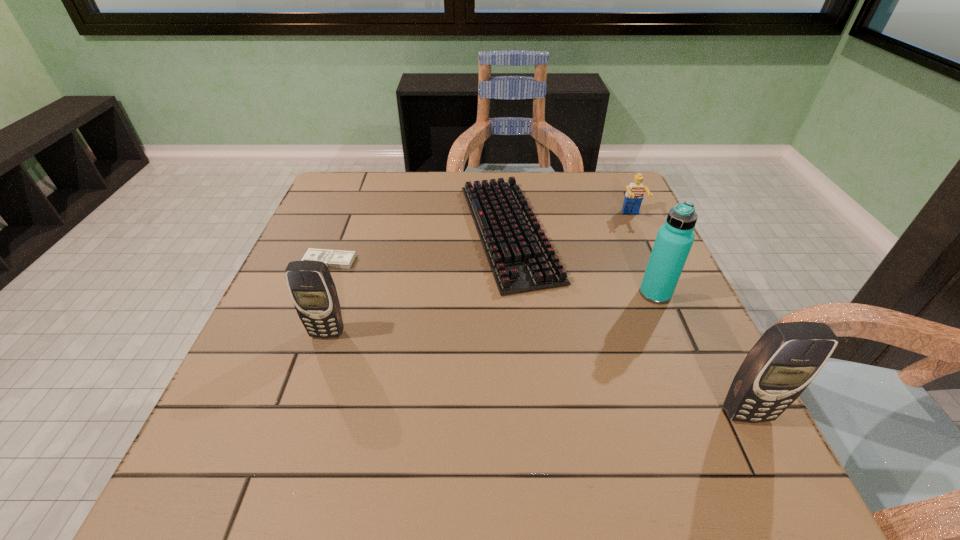
Locate an element on the screen. vacant space that is in between the second shortest object and the money is located at coordinates (420, 246).

Identify the location of free area in between the shorter cellular telephone and the fourth tallest object. (480, 274).

In order to click on vacant point located between the right cellular telephone and the fourth shortest object in this screenshot , I will do `click(537, 374)`.

The width and height of the screenshot is (960, 540). What are the coordinates of `vacant region between the shortest object and the nearest object` in the screenshot? It's located at (538, 338).

Find the location of a particular element. The width and height of the screenshot is (960, 540). vacant space that's between the second shortest object and the nearest object is located at coordinates click(628, 323).

I want to click on unoccupied position between the water bottle and the shorter cellular telephone, so click(x=492, y=314).

Point out which object is positioned as the third nearest to the computer keyboard. Please provide its 2D coordinates. Your answer should be formatted as a tuple, i.e. [(x, y)], where the tuple contains the x and y coordinates of a point satisfying the conditions above.

[(313, 292)]

Identify which object is the second nearest to the right cellular telephone. Please provide its 2D coordinates. Your answer should be formatted as a tuple, i.e. [(x, y)], where the tuple contains the x and y coordinates of a point satisfying the conditions above.

[(521, 258)]